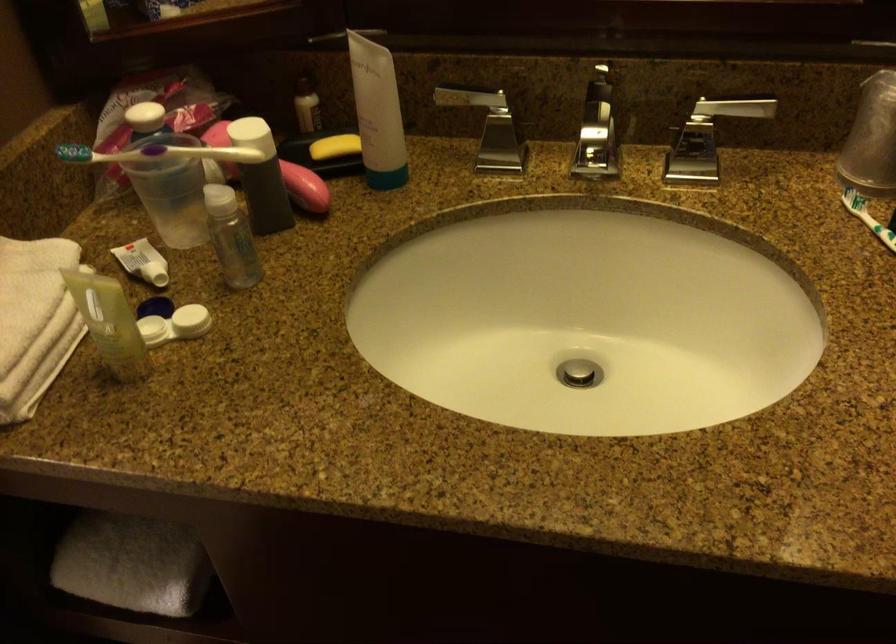
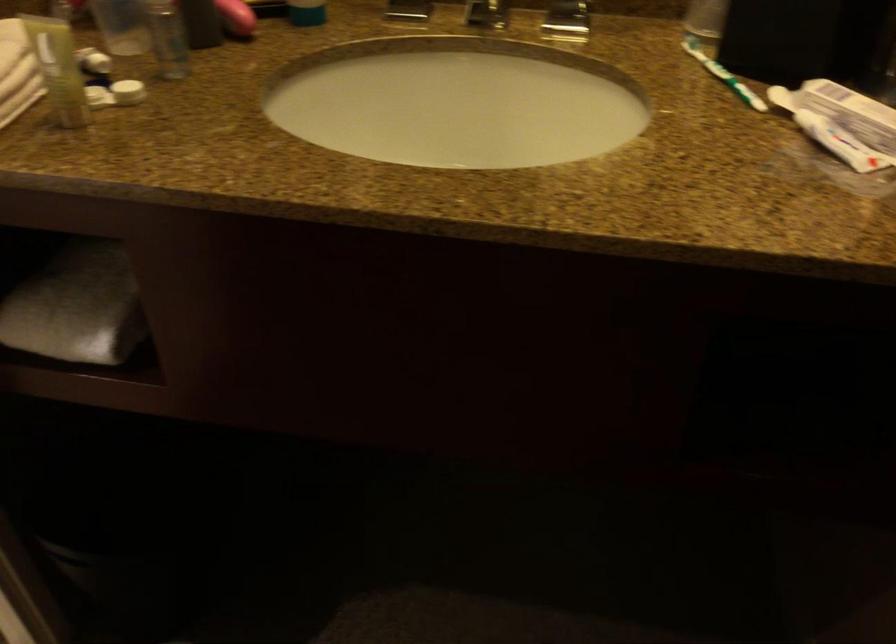
In the second image, find the point that corresponds to the point at 143,550 in the first image.

(76, 306)